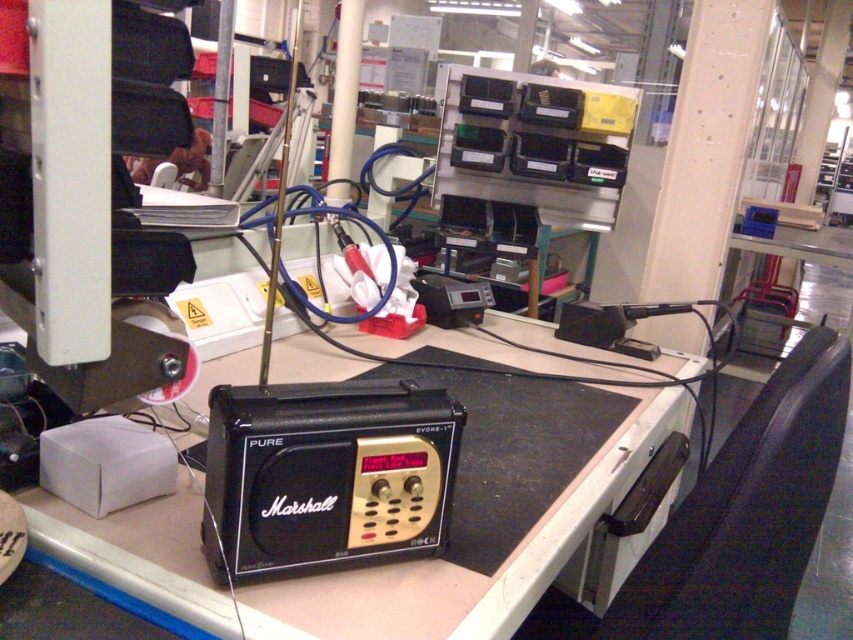
Question: Considering the relative positions of black plastic table at center and black matte radio at center in the image provided, where is black plastic table at center located with respect to black matte radio at center?

Choices:
 (A) above
 (B) below

Answer: (B)

Question: Which point appears farthest from the camera in this image?

Choices:
 (A) (265, 422)
 (B) (193, 540)

Answer: (B)

Question: In this image, where is black plastic table at center located relative to black matte radio at center?

Choices:
 (A) left
 (B) right

Answer: (B)

Question: Is black plastic table at center positioned before black matte radio at center?

Choices:
 (A) no
 (B) yes

Answer: (B)